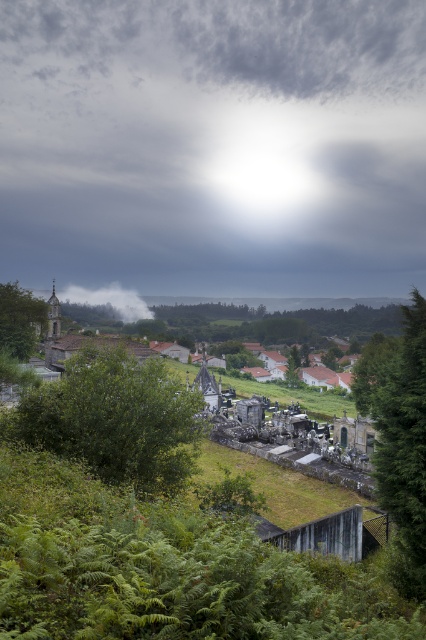
In the scene shown: You are an explorer lost in the forest and see the green leafy tree at right and the white fog at center. Which object is closer to you?

The green leafy tree at right is closer to you because it is positioned in front of the white fog at center.